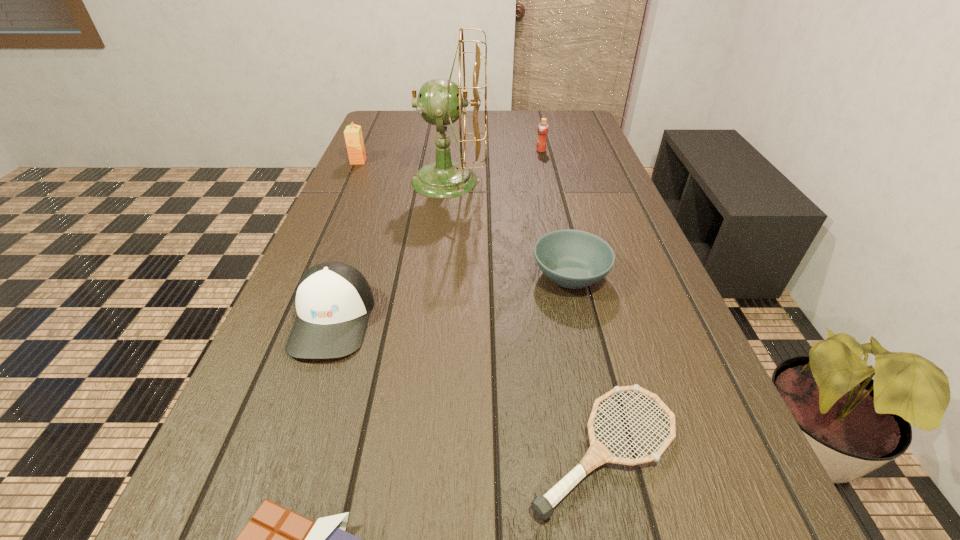
Where is `vacant space located 0.080m on the front panel of the cap`? vacant space located 0.080m on the front panel of the cap is located at coordinates (303, 404).

I want to click on free space located on the back of the third shortest object, so click(548, 180).

The width and height of the screenshot is (960, 540). In order to click on free space located 0.090m on the left of the tennis racket in this screenshot , I will do `click(464, 450)`.

Locate an element on the screen. The image size is (960, 540). orange juice that is at the left edge is located at coordinates (353, 134).

At what (x,y) coordinates should I click in order to perform the action: click on cap that is positioned at the left edge. Please return your answer as a coordinate pair (x, y). The height and width of the screenshot is (540, 960). Looking at the image, I should click on (333, 300).

Identify the location of soup bowl that is positioned at the right edge. The height and width of the screenshot is (540, 960). (574, 259).

At what (x,y) coordinates should I click in order to perform the action: click on tennis racket present at the right edge. Please return your answer as a coordinate pair (x, y). Looking at the image, I should click on (598, 454).

Where is `free space at the far edge of the desktop`? free space at the far edge of the desktop is located at coordinates click(x=430, y=134).

What are the coordinates of `vacant space at the right edge` in the screenshot? It's located at (592, 187).

At what (x,y) coordinates should I click in order to perform the action: click on vacant space at the far left corner of the desktop. Please return your answer as a coordinate pair (x, y). The width and height of the screenshot is (960, 540). Looking at the image, I should click on (409, 114).